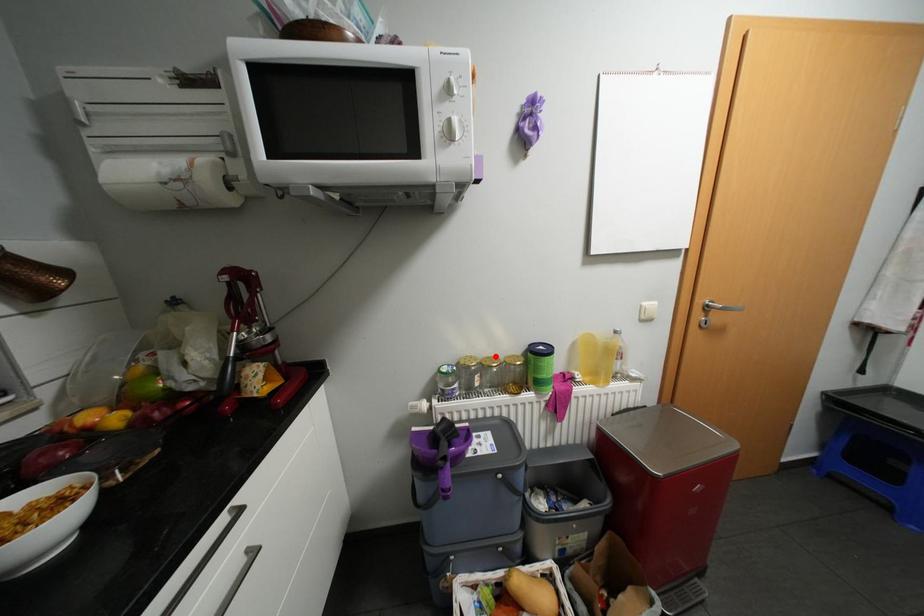
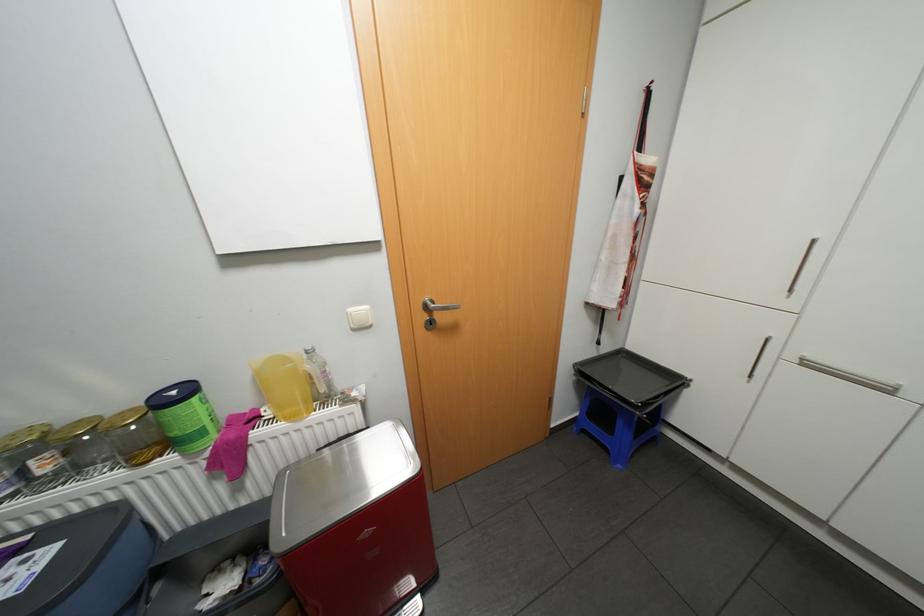
Locate, in the second image, the point that corresponds to the highlighted location in the first image.

(88, 419)